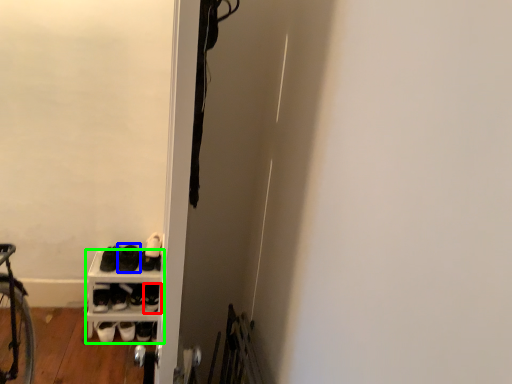
Question: Based on their relative distances, which object is nearer to footwear (highlighted by a red box)? Choose from footwear (highlighted by a blue box) and shelf (highlighted by a green box).

Choices:
 (A) footwear
 (B) shelf

Answer: (B)